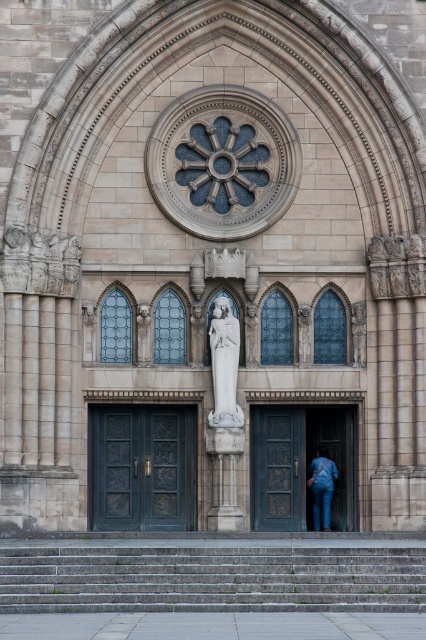
Does dark brown wood door at center have a greater height compared to white marble statue at center?

No, dark brown wood door at center is not taller than white marble statue at center.

Describe the element at coordinates (278, 468) in the screenshot. I see `dark brown wood door at center` at that location.

Between point (290, 490) and point (232, 396), which one is positioned in front?

Point (232, 396) is more forward.

The height and width of the screenshot is (640, 426). I want to click on dark brown wood door at center, so click(278, 468).

Who is more forward, (229,406) or (356,358)?

Point (229,406)

Is point (224, 426) more distant than point (354, 332)?

That is False.

Find the location of a particular element. white marble statue at center is located at coordinates (224, 364).

Between dark wood door at center and white marble statue at center, which one has less height?

Standing shorter between the two is white marble statue at center.

Can you confirm if dark wood door at center is smaller than white marble statue at center?

No.

Which is in front, point (270, 488) or point (242, 416)?

Point (242, 416) is more forward.

Identify the location of dark wood door at center. The height and width of the screenshot is (640, 426). (299, 465).